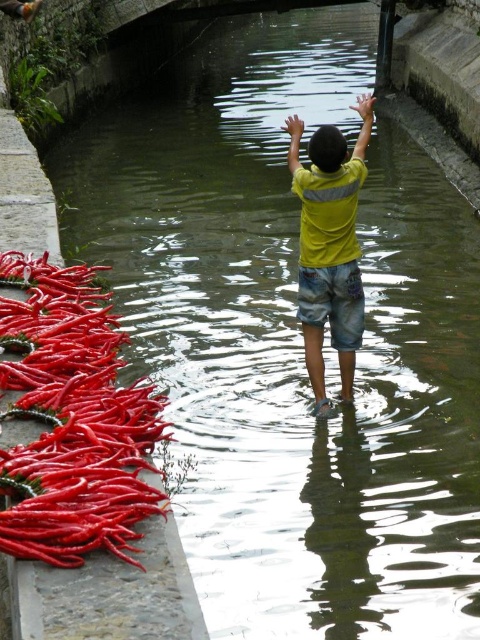
Is point (80, 534) behind point (337, 339)?

No.

The image size is (480, 640). I want to click on bright red chili peppers at left, so click(72, 420).

In order to click on bright red chili peppers at left in this screenshot , I will do `click(72, 420)`.

Locate an element on the screen. This screenshot has height=640, width=480. bright red chili peppers at left is located at coordinates (72, 420).